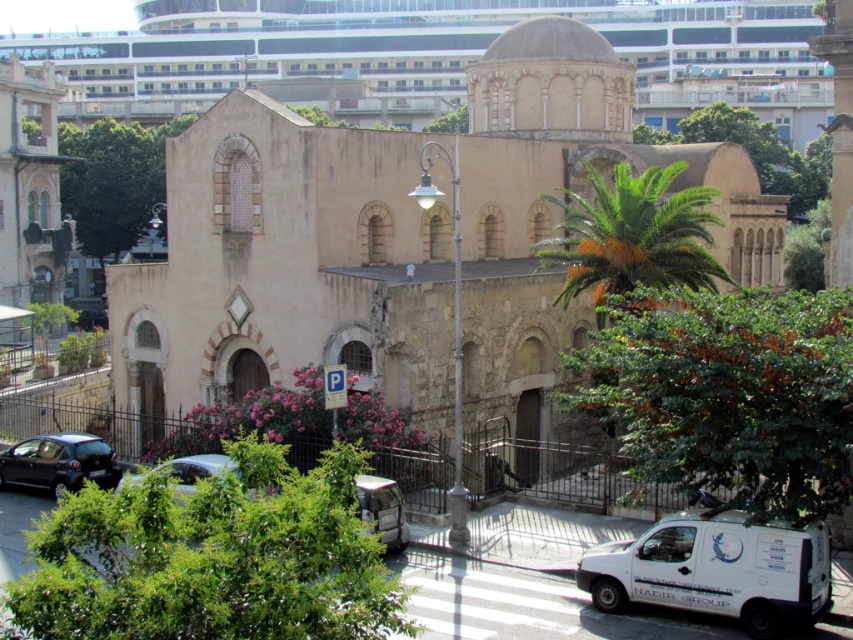
You are a pedestrian standing at the pedestrian crossing in front of the beige stone church at center. You want to cross the road to reach the white matte van at lower right. Is the van directly in front of you or to your side?

The beige stone church at center is above the white matte van at lower right, meaning the van is positioned lower on the image. Since you are at the pedestrian crossing in front of the church, the white matte van at lower right would be to your right side, not directly in front.